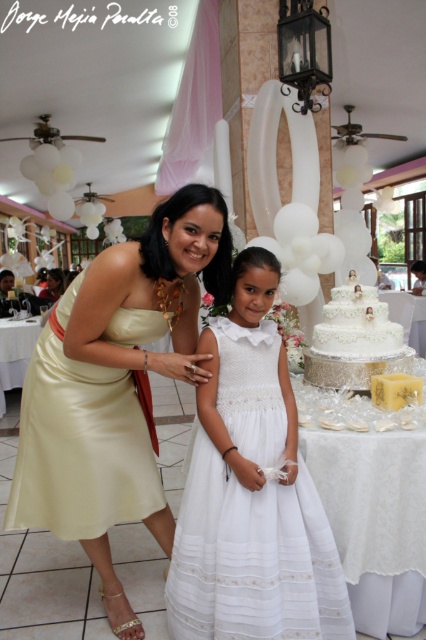
Can you confirm if white sheer dress at center is taller than satin gold dress at left?

Correct, white sheer dress at center is much taller as satin gold dress at left.

Between white sheer dress at center and satin gold dress at left, which one has more height?

Standing taller between the two is white sheer dress at center.

This screenshot has height=640, width=426. Describe the element at coordinates (253, 557) in the screenshot. I see `white sheer dress at center` at that location.

Locate an element on the screen. This screenshot has width=426, height=640. white sheer dress at center is located at coordinates (253, 557).

Who is more distant from viewer, (321, 573) or (327, 340)?

Point (327, 340)

Is white sheer dress at center shorter than white textured cake at center?

No.

Between point (311, 561) and point (371, 307), which one is positioned in front?

Point (311, 561) is in front.

At what (x,y) coordinates should I click in order to perform the action: click on white sheer dress at center. Please return your answer as a coordinate pair (x, y). Looking at the image, I should click on (253, 557).

Between satin white dress at center and white sheer dress at center, which one is positioned higher?

Positioned higher is satin white dress at center.

Is point (175, 332) more distant than point (215, 332)?

Yes, it is.

Describe the element at coordinates (115, 387) in the screenshot. I see `satin white dress at center` at that location.

This screenshot has height=640, width=426. What are the coordinates of `satin white dress at center` in the screenshot? It's located at (115, 387).